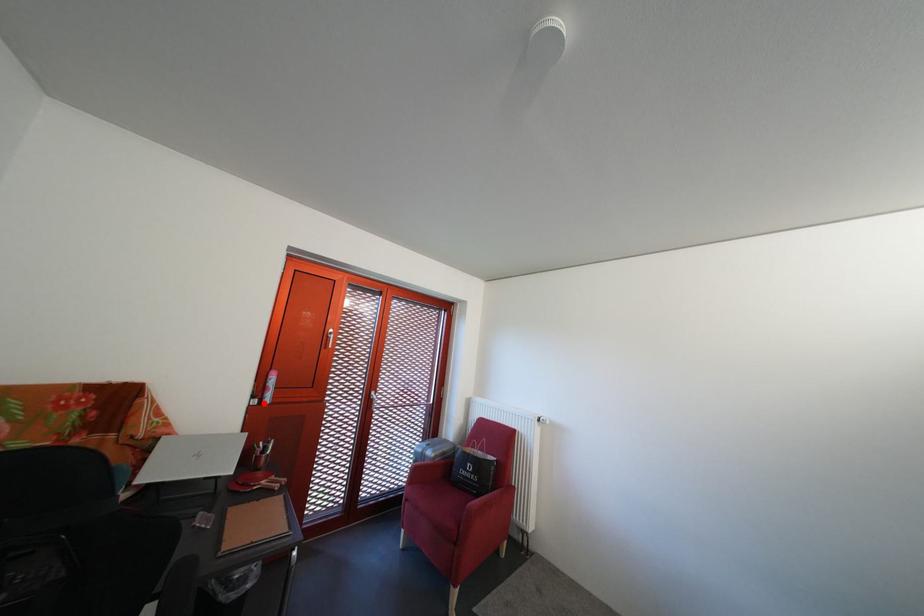
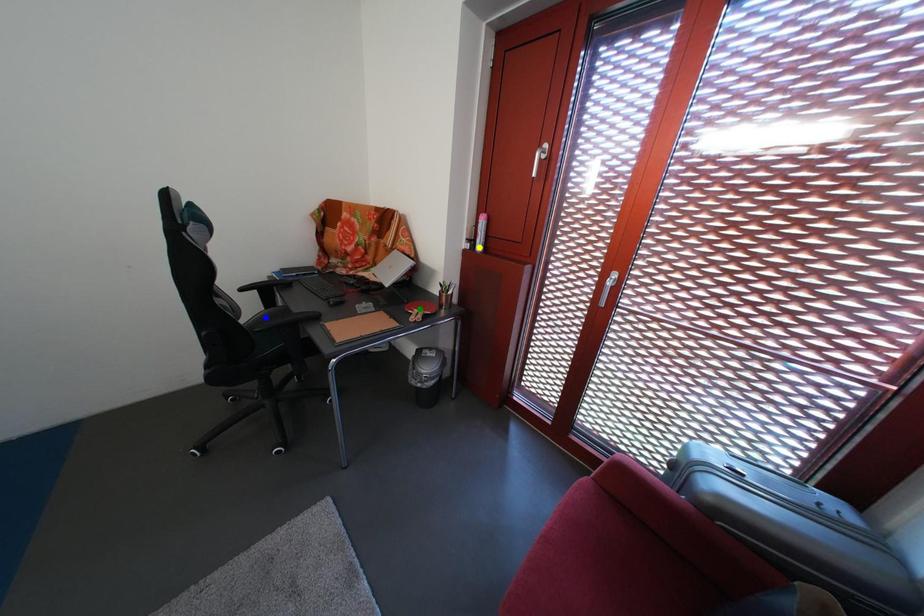
Question: I am providing you with two images of the same scene from different viewpoints. A red point is marked on the first image. You are given multiple points on the second image. Which point in image 2 represents the same 3d spot as the red point in image 1?

Choices:
 (A) yellow point
 (B) green point
 (C) blue point

Answer: (A)